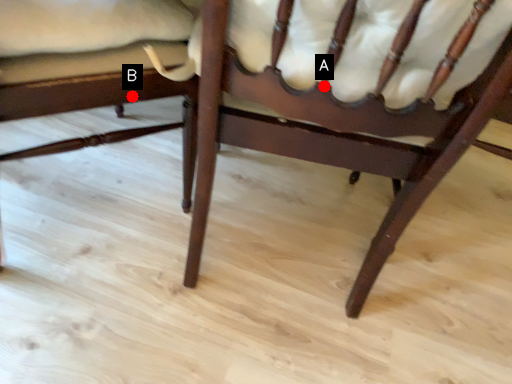
Question: Two points are circled on the image, labeled by A and B beside each circle. Which point is closer to the camera?

Choices:
 (A) A is closer
 (B) B is closer

Answer: (A)